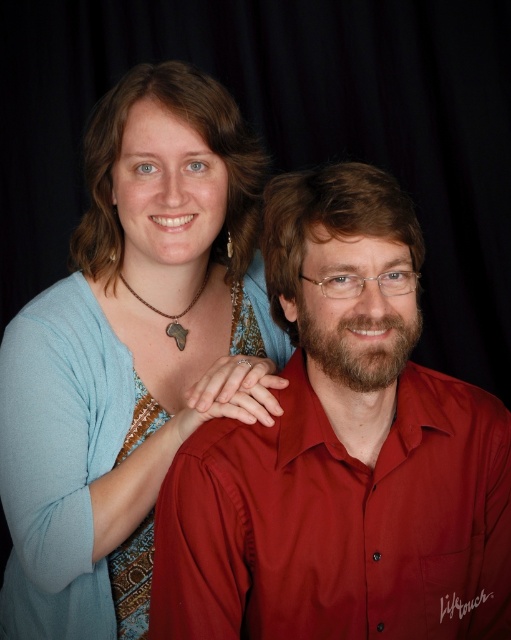
You are a photographer setting up a shoot in a studio with a black curtain background. You need to ensure that the matte red shirt at center and the matte blue sweater at upper left are visible to the audience. Based on their positions, which object is more to the right?

The matte red shirt at center is positioned on the right side of the matte blue sweater at upper left, so the matte red shirt at center is more to the right.

In the scene shown: You are an assistant analyzing the image. The scene shows two people posing against a black curtain. The person on the left wears a light blue cardigan and has a necklace shaped like Africa. The person on the right has a short... Wait, the objects given are only the matte red shirt at center. The objects description says it is located at point 0.709, 0.669. I need to form a question that uses the objects exactly as given. The question should not reveal the coordinates. The answer should use the coordinates.

The matte red shirt at center is located at coordinates (x=341, y=452) in the image.

In the image, there are two people standing against a dark background. The person on the left wears a light blue cardigan and has a necklace shaped like Africa. The person on the right has short hair. There is a point at coordinates (341, 452). Which object from the scene does this point belong to?

The point at (341, 452) is on the matte red shirt at center.